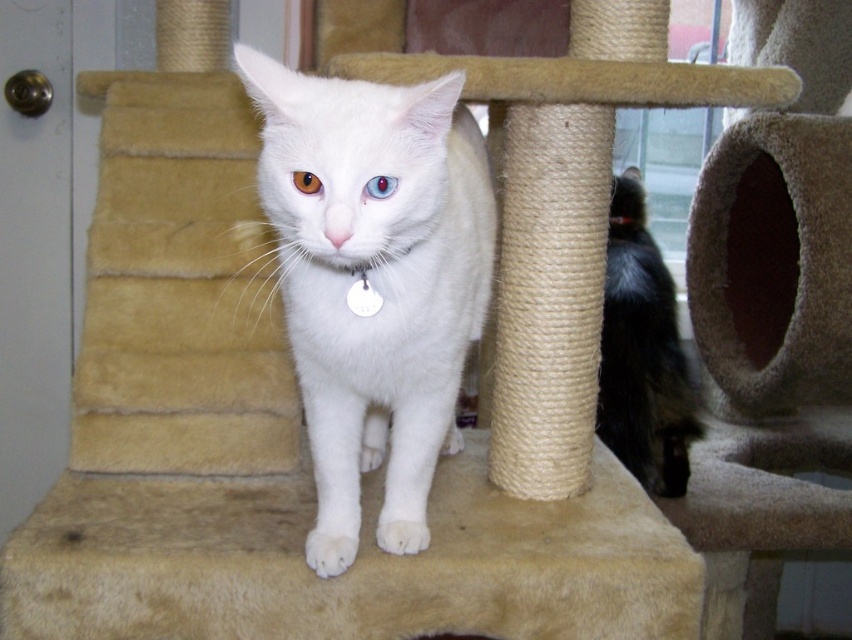
Question: Which of the following is the closest to the observer?

Choices:
 (A) brown glossy eye at center
 (B) black fuzzy cat at right
 (C) white fur cat at center
 (D) beige carpeted cat bed at center

Answer: (C)

Question: Is black fuzzy cat at right thinner than blue glossy eye at center?

Choices:
 (A) yes
 (B) no

Answer: (B)

Question: Which of the following is the closest to the observer?

Choices:
 (A) (381, 184)
 (B) (199, 406)
 (C) (396, 140)

Answer: (A)

Question: Is beige carpeted cat bed at center behind brown glossy eye at center?

Choices:
 (A) yes
 (B) no

Answer: (B)

Question: Does beige carpeted cat bed at center come behind black fuzzy cat at right?

Choices:
 (A) no
 (B) yes

Answer: (A)

Question: Among these objects, which one is nearest to the camera?

Choices:
 (A) brown glossy eye at center
 (B) black fuzzy cat at right

Answer: (A)